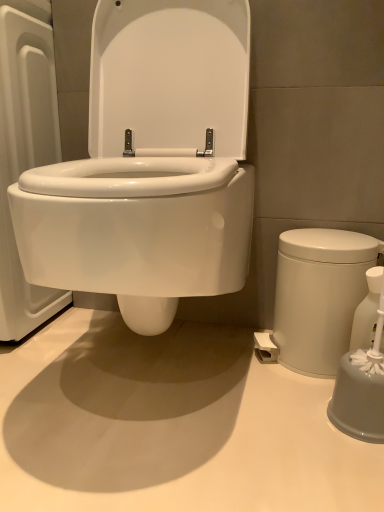
Image resolution: width=384 pixels, height=512 pixels. What are the coordinates of `free space above white glossy trash can at right (from a real-world perspective)` in the screenshot? It's located at (331, 234).